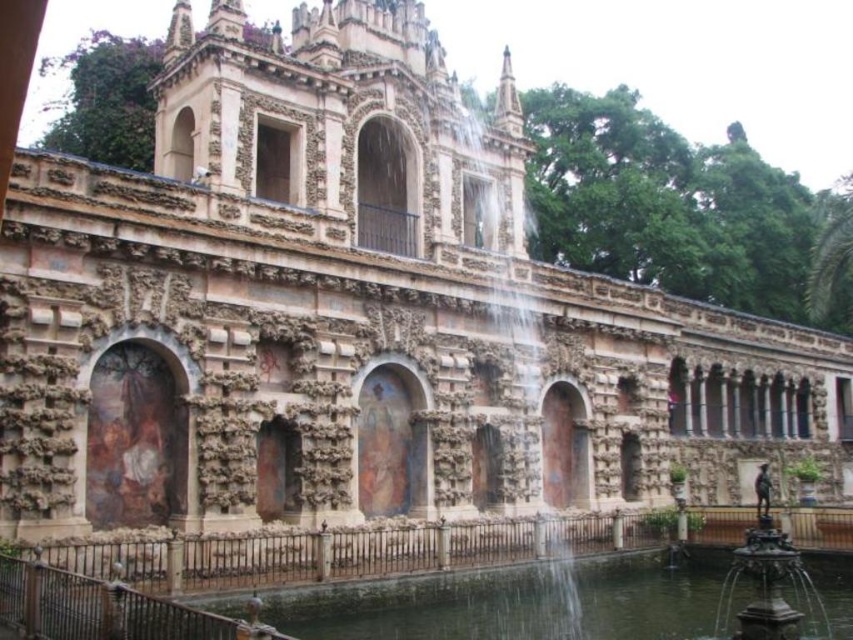
You are standing in front of the historic building and want to locate the clear water at fountain center. According to the coordinates provided, where exactly is it positioned?

The clear water at fountain center is positioned at point (515, 602).